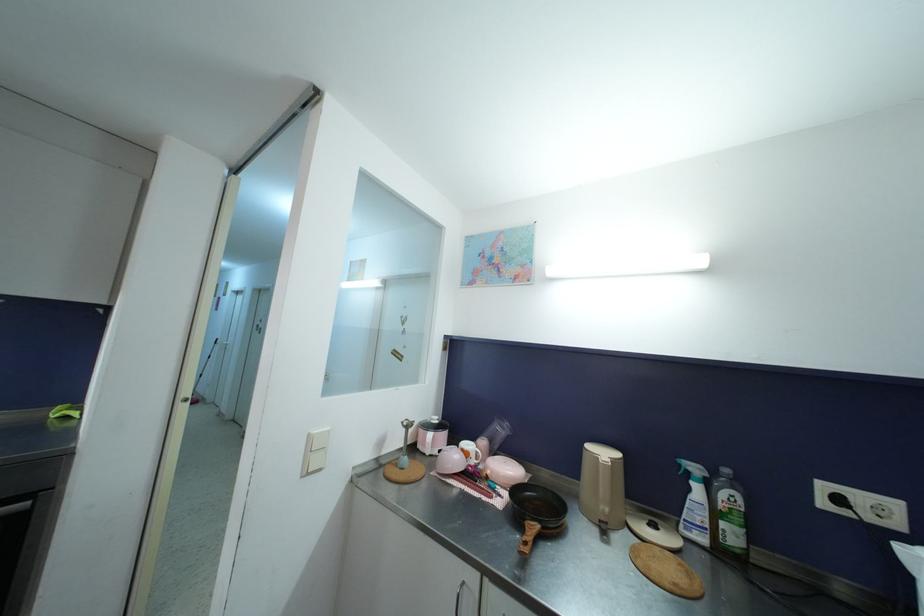
Find where to squeez the spray bottle trigger. Please return your answer as a coordinate pair (x, y).

(682, 461)